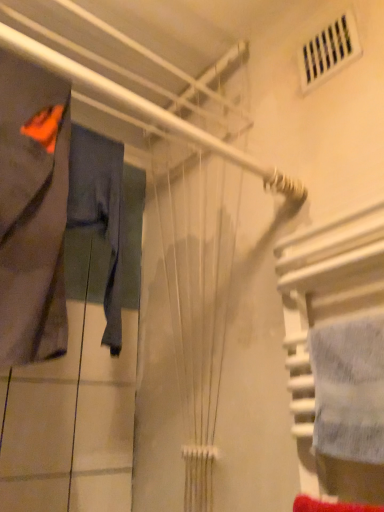
Question: Considering the relative sizes of matte gray fabric at left, the second clothing viewed from the back, and denim pants at left, placed as the first clothing when sorted from back to front, in the image provided, is matte gray fabric at left, the second clothing viewed from the back, thinner than denim pants at left, placed as the first clothing when sorted from back to front,?

Choices:
 (A) no
 (B) yes

Answer: (A)

Question: Can you confirm if matte gray fabric at left, the second clothing viewed from the back, is positioned to the left of denim pants at left, which is the 2th clothing from front to back?

Choices:
 (A) no
 (B) yes

Answer: (B)

Question: From a real-world perspective, is matte gray fabric at left, positioned as the 1th clothing in front-to-back order, under denim pants at left, placed as the first clothing when sorted from back to front?

Choices:
 (A) no
 (B) yes

Answer: (B)

Question: Is matte gray fabric at left, the second clothing viewed from the back, positioned with its back to denim pants at left, which is the 2th clothing from front to back?

Choices:
 (A) no
 (B) yes

Answer: (A)

Question: Does matte gray fabric at left, the second clothing viewed from the back, lie behind denim pants at left, placed as the first clothing when sorted from back to front?

Choices:
 (A) yes
 (B) no

Answer: (B)

Question: Visually, is denim pants at left, which is the 2th clothing from front to back, positioned to the left or to the right of matte gray fabric at left, the second clothing viewed from the back?

Choices:
 (A) right
 (B) left

Answer: (A)

Question: Considering the positions of point (104, 138) and point (36, 76), is point (104, 138) closer or farther from the camera than point (36, 76)?

Choices:
 (A) closer
 (B) farther

Answer: (B)

Question: In terms of width, does denim pants at left, which is the 2th clothing from front to back, look wider or thinner when compared to matte gray fabric at left, positioned as the 1th clothing in front-to-back order?

Choices:
 (A) wide
 (B) thin

Answer: (B)

Question: From their relative heights in the image, would you say denim pants at left, placed as the first clothing when sorted from back to front, is taller or shorter than matte gray fabric at left, positioned as the 1th clothing in front-to-back order?

Choices:
 (A) short
 (B) tall

Answer: (A)

Question: Is point (31, 183) closer or farther from the camera than point (112, 153)?

Choices:
 (A) closer
 (B) farther

Answer: (A)

Question: From a real-world perspective, is matte gray fabric at left, the second clothing viewed from the back, physically located above or below denim pants at left, which is the 2th clothing from front to back?

Choices:
 (A) above
 (B) below

Answer: (B)

Question: In terms of size, does matte gray fabric at left, positioned as the 1th clothing in front-to-back order, appear bigger or smaller than denim pants at left, placed as the first clothing when sorted from back to front?

Choices:
 (A) big
 (B) small

Answer: (A)

Question: From the image's perspective, relative to denim pants at left, which is the 2th clothing from front to back, is matte gray fabric at left, the second clothing viewed from the back, above or below?

Choices:
 (A) above
 (B) below

Answer: (A)

Question: Is denim pants at left, which is the 2th clothing from front to back, wider or thinner than white textured towel at right?

Choices:
 (A) thin
 (B) wide

Answer: (B)

Question: Do you think denim pants at left, which is the 2th clothing from front to back, is within white textured towel at right, or outside of it?

Choices:
 (A) outside
 (B) inside

Answer: (A)